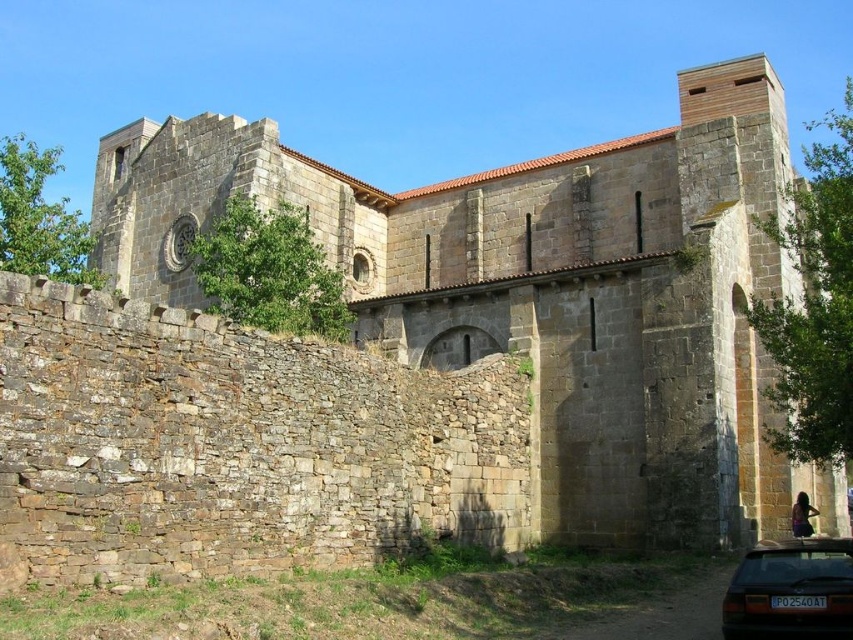
Is stone church at center to the left of dark brown metallic car at lower right from the viewer's perspective?

Correct, you'll find stone church at center to the left of dark brown metallic car at lower right.

Which is more to the left, stone church at center or dark brown metallic car at lower right?

→ From the viewer's perspective, stone church at center appears more on the left side.

Describe the element at coordinates (543, 292) in the screenshot. The height and width of the screenshot is (640, 853). I see `stone church at center` at that location.

You are a GUI agent. You are given a task and a screenshot of the screen. Output one action in this format:
    pyautogui.click(x=<x>, y=<y>)
    Task: Click on the stone church at center
    The height and width of the screenshot is (640, 853).
    Given the screenshot: What is the action you would take?
    pyautogui.click(x=543, y=292)